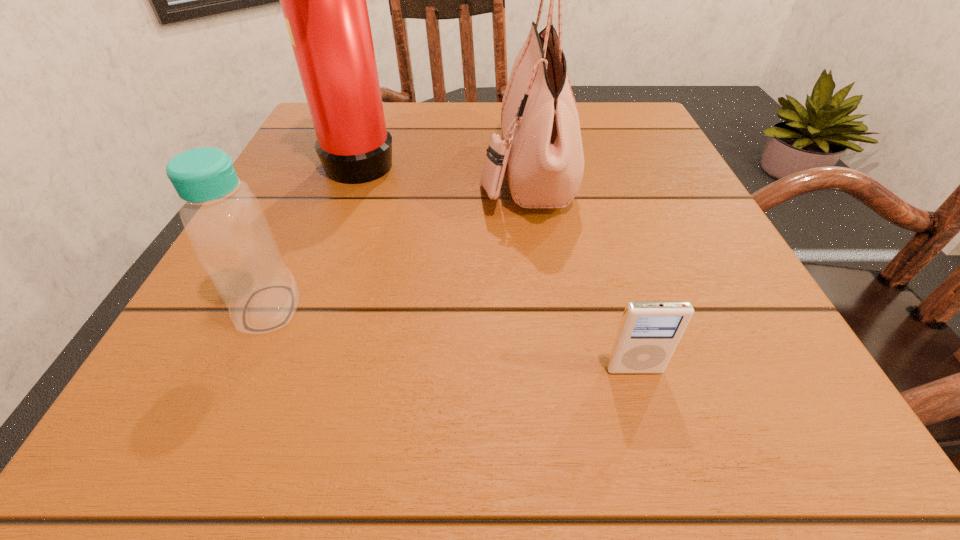
Identify the location of free space located 0.310m on the right of the second shortest object. The image size is (960, 540). (533, 308).

Find the location of a particular element. The width and height of the screenshot is (960, 540). blank area located on the front-facing side of the iPod is located at coordinates (658, 451).

Where is `fire extinguisher that is at the far edge`? fire extinguisher that is at the far edge is located at coordinates (324, 0).

Identify the location of handbag present at the far edge. The height and width of the screenshot is (540, 960). pos(541,153).

Where is `fire extinguisher that is at the left edge`? fire extinguisher that is at the left edge is located at coordinates (324, 0).

The width and height of the screenshot is (960, 540). I want to click on bottle that is at the left edge, so pyautogui.click(x=224, y=221).

This screenshot has height=540, width=960. I want to click on object that is at the right edge, so click(649, 332).

This screenshot has height=540, width=960. In order to click on object that is at the far left corner in this screenshot , I will do `click(324, 0)`.

You are a GUI agent. You are given a task and a screenshot of the screen. Output one action in this format:
    pyautogui.click(x=<x>, y=<y>)
    Task: Click on the free space at the far edge of the desktop
    
    Given the screenshot: What is the action you would take?
    tap(492, 117)

In the image, there is a desktop. In order to click on free space at the left edge in this screenshot , I will do `click(315, 168)`.